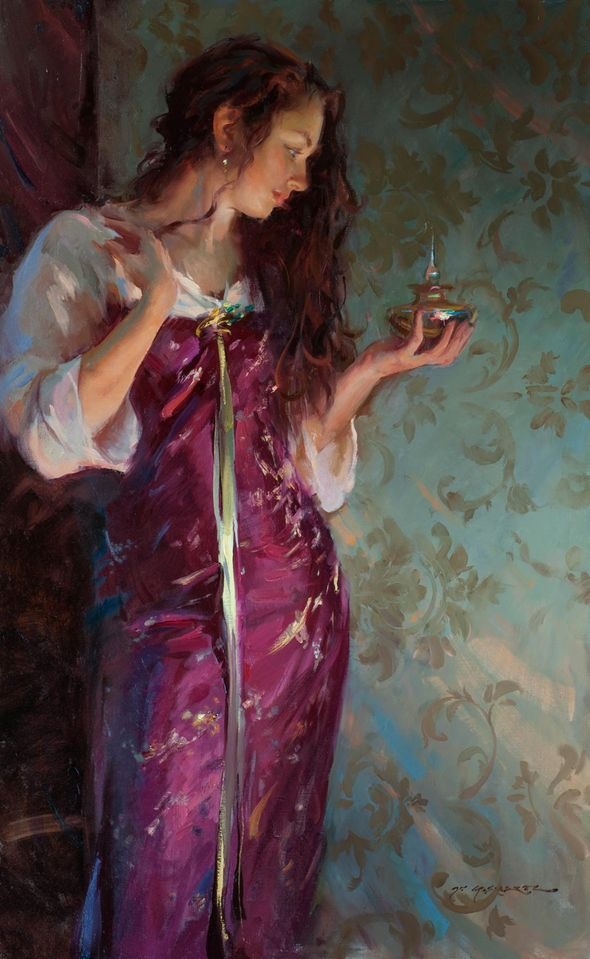
At what (x,y) coordinates should I click in order to perform the action: click on wallpaper design on wall in back of painting. Please return your answer as a coordinate pair (x, y). The width and height of the screenshot is (590, 959). Looking at the image, I should click on (478, 520).